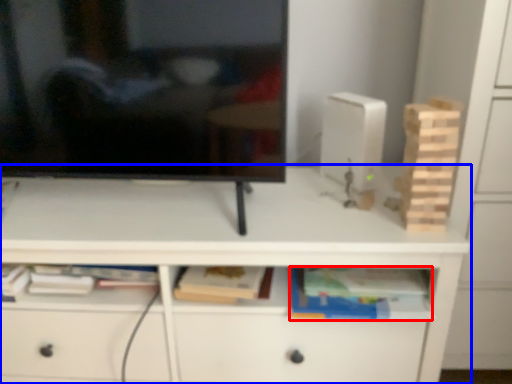
Question: Which of the following is the closest to the observer, book (highlighted by a red box) or desk (highlighted by a blue box)?

Choices:
 (A) book
 (B) desk

Answer: (B)